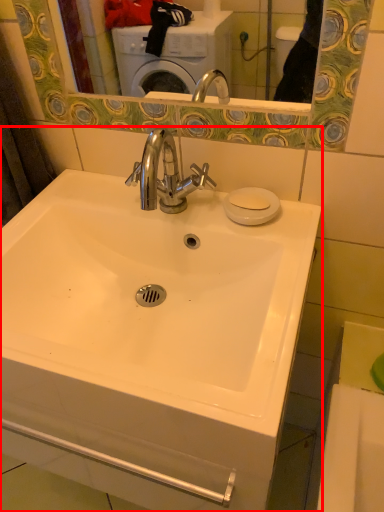
Question: From the image's perspective, considering the relative positions of sink (annotated by the red box) and soap in the image provided, where is sink (annotated by the red box) located with respect to the staircase?

Choices:
 (A) above
 (B) below

Answer: (B)